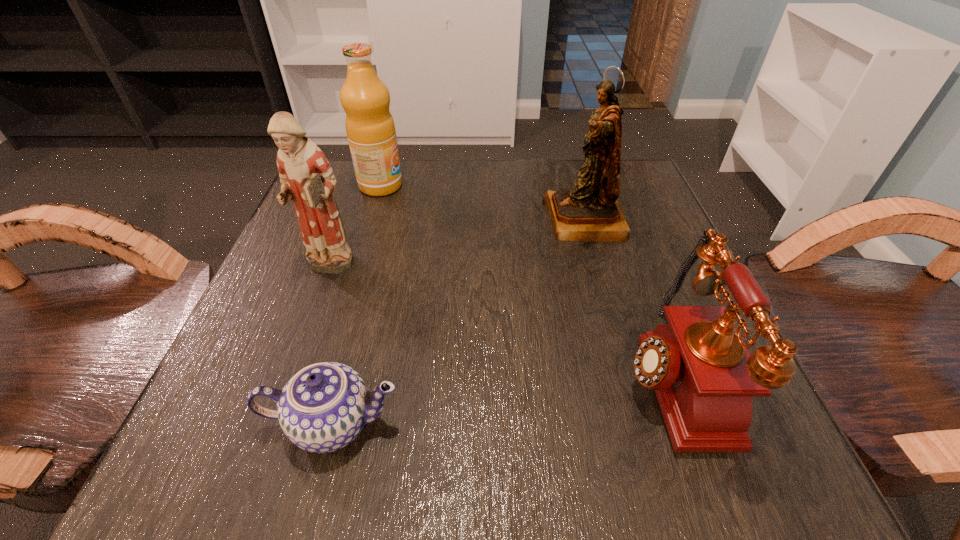
I want to click on unoccupied position between the right figurine and the shortest object, so click(x=459, y=322).

I want to click on vacant area between the third farthest object and the shortest object, so click(331, 346).

Locate an element on the screen. vacant area that lies between the left figurine and the fourth tallest object is located at coordinates (497, 323).

The width and height of the screenshot is (960, 540). I want to click on free space between the fruit juice and the fourth tallest object, so click(x=524, y=281).

This screenshot has width=960, height=540. In order to click on object that ranks as the third closest to the fruit juice in this screenshot , I will do `click(322, 408)`.

Find the location of a particular element. The width and height of the screenshot is (960, 540). the third closest object to the shortest object is located at coordinates (590, 212).

The width and height of the screenshot is (960, 540). I want to click on free location that satisfies the following two spatial constraints: 1. on the dial of the fourth tallest object; 2. at the spout of the chinaware, so click(x=684, y=423).

Identify the location of vacant region that satisfies the following two spatial constraints: 1. on the dial of the second shortest object; 2. at the spout of the chinaware. (684, 423).

Where is `vacant space that satisfies the following two spatial constraints: 1. on the front-facing side of the farther figurine; 2. on the front-facing side of the third nearest object`? This screenshot has height=540, width=960. vacant space that satisfies the following two spatial constraints: 1. on the front-facing side of the farther figurine; 2. on the front-facing side of the third nearest object is located at coordinates (598, 268).